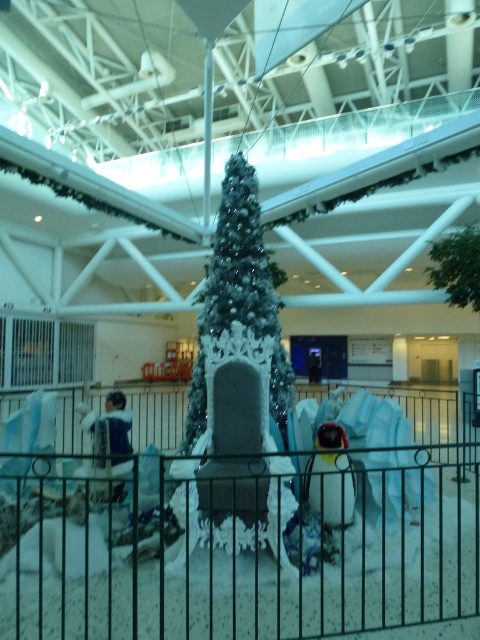
Question: Which point is farther to the camera?

Choices:
 (A) (475, 300)
 (B) (16, 561)
 (C) (207, 307)

Answer: (A)

Question: Does black metal fence at center have a smaller size compared to green leafy tree at upper right?

Choices:
 (A) no
 (B) yes

Answer: (A)

Question: Which object appears closest to the camera in this image?

Choices:
 (A) white frosted christmas tree at center
 (B) black metal fence at center
 (C) green leafy tree at upper right

Answer: (B)

Question: Is white frosted christmas tree at center above green leafy tree at upper right?

Choices:
 (A) yes
 (B) no

Answer: (B)

Question: Which point appears closest to the camera in this image?

Choices:
 (A) (269, 387)
 (B) (468, 266)

Answer: (A)

Question: Observing the image, what is the correct spatial positioning of black metal fence at center in reference to green leafy tree at upper right?

Choices:
 (A) right
 (B) left

Answer: (B)